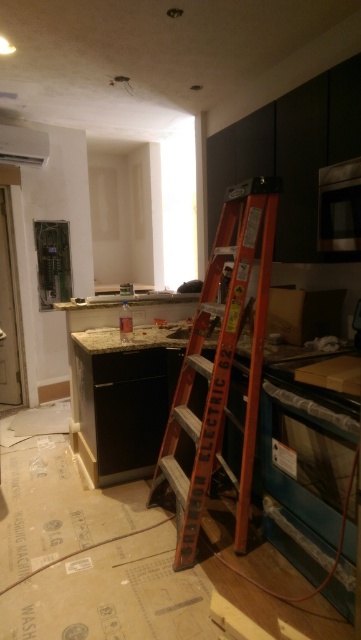
Is point (176, 561) farther from camera compared to point (15, 138)?

No, (176, 561) is closer to viewer.

Is point (236, 316) positioned in front of point (28, 145)?

Yes, it is.

Is point (240, 552) closer to camera compared to point (18, 157)?

Yes.

I want to click on orange wooden ladder at center, so click(x=219, y=369).